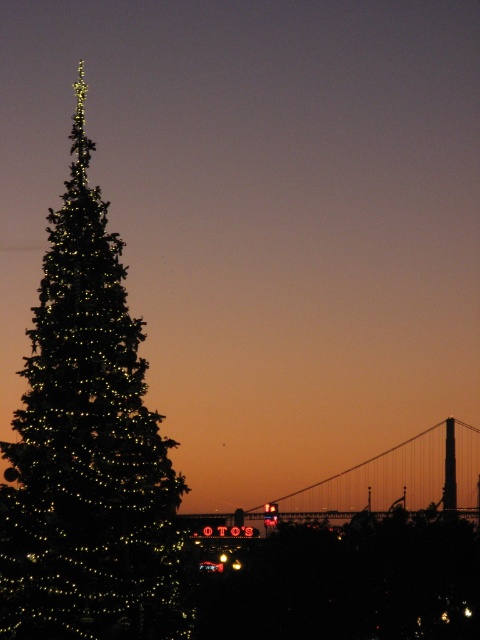
Question: Which of the following is the closest to the observer?

Choices:
 (A) (121, 244)
 (B) (422, 481)

Answer: (A)

Question: Which point appears farthest from the camera in this image?

Choices:
 (A) (95, 196)
 (B) (372, 474)

Answer: (B)

Question: Is the position of illuminated matte green christmas tree at left less distant than that of metallic bridge at center?

Choices:
 (A) no
 (B) yes

Answer: (B)

Question: Is illuminated matte green christmas tree at left to the right of metallic bridge at center from the viewer's perspective?

Choices:
 (A) yes
 (B) no

Answer: (B)

Question: Is illuminated matte green christmas tree at left above metallic bridge at center?

Choices:
 (A) yes
 (B) no

Answer: (A)

Question: Which object appears farthest from the camera in this image?

Choices:
 (A) illuminated matte green christmas tree at left
 (B) metallic bridge at center

Answer: (B)